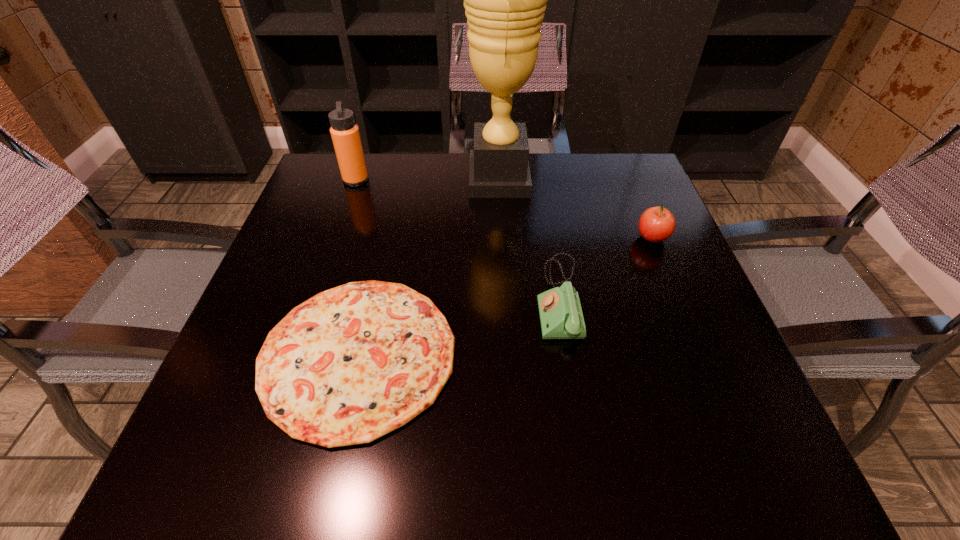
The image size is (960, 540). Find the location of `trophy cup`. trophy cup is located at coordinates (505, 0).

Identify the location of the second tallest object. This screenshot has width=960, height=540. (345, 134).

Locate an element on the screen. The width and height of the screenshot is (960, 540). the rightmost object is located at coordinates (656, 224).

Identify the location of apple. (656, 224).

This screenshot has height=540, width=960. I want to click on telephone, so click(x=561, y=317).

Image resolution: width=960 pixels, height=540 pixels. I want to click on pizza, so point(353,363).

What are the coordinates of `vacant region located 0.060m at the front of the tallest object with handles` in the screenshot? It's located at (444, 179).

Find the location of a particular element. vacant area located 0.170m at the front of the tallest object with handles is located at coordinates (403, 179).

Identify the location of free space located 0.290m at the front of the tallest object with handles. (359, 179).

Locate an element on the screen. free space located 0.160m on the front of the fourth shortest object is located at coordinates (340, 226).